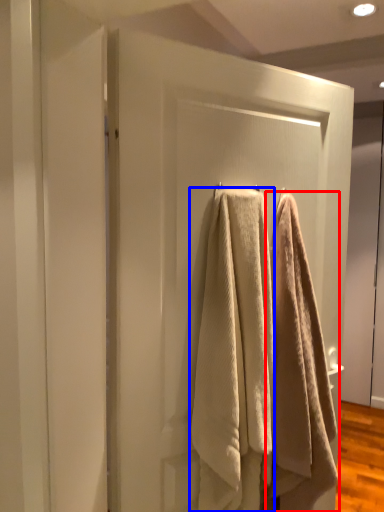
Question: Which of the following is the farthest to the observer, towel (highlighted by a red box) or towel (highlighted by a blue box)?

Choices:
 (A) towel
 (B) towel

Answer: (A)